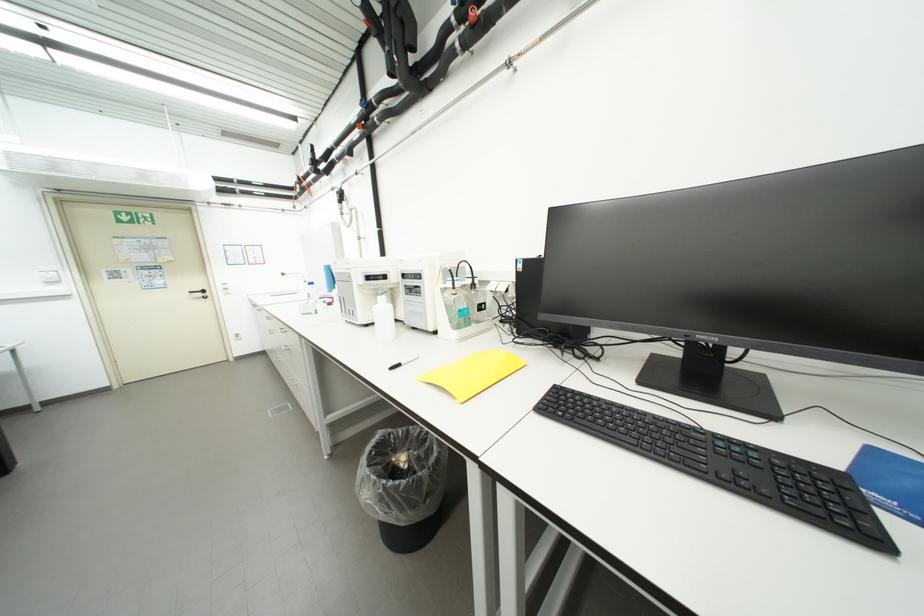
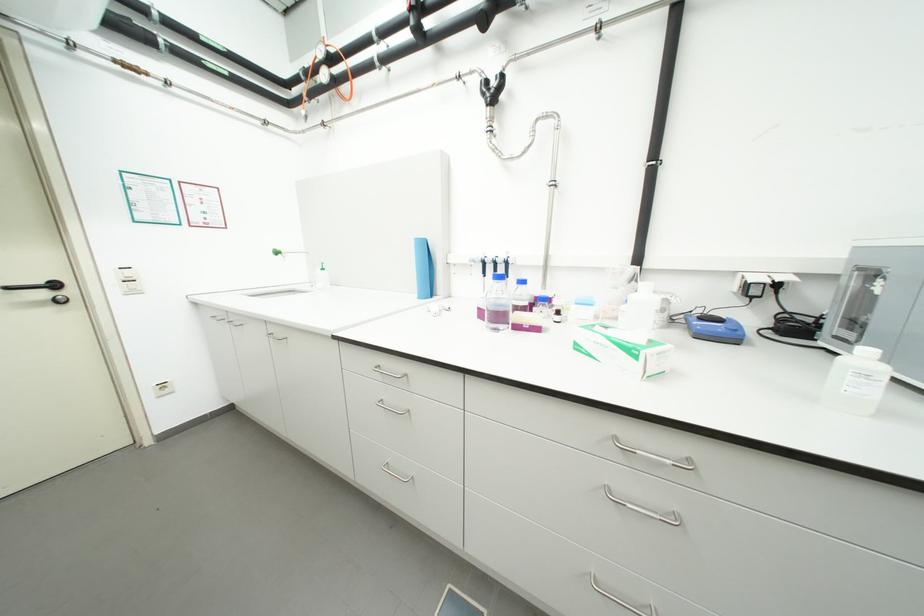
What movement of the cameraman would produce the second image?

The movement direction of the cameraman is left, forward.